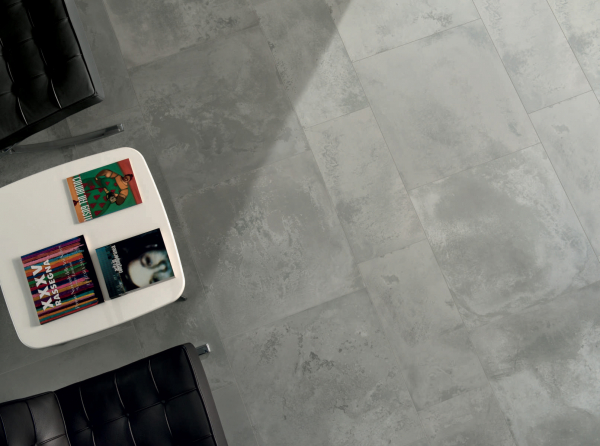
Where is `white tabletop`? The image size is (600, 446). white tabletop is located at coordinates (33, 234).